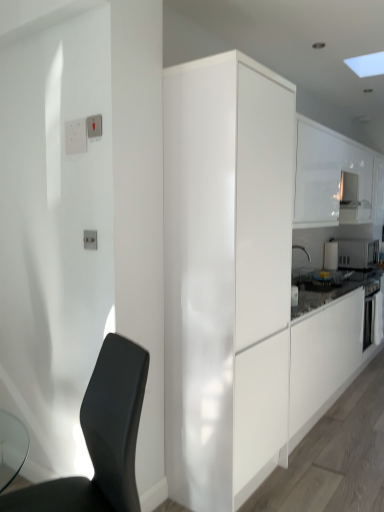
Question: Which is correct: white plastic light switch at upper left, which appears as the first light switch when viewed from the front, is inside glossy white cabinet at center, placed as the first cabinetry when sorted from left to right, or outside of it?

Choices:
 (A) outside
 (B) inside

Answer: (A)

Question: In the image, is white plastic light switch at upper left, the 2th light switch from the left, positioned in front of or behind glossy white cabinet at center, which ranks as the 2th cabinetry in back-to-front order?

Choices:
 (A) behind
 (B) front

Answer: (A)

Question: Which object is positioned farthest from the white glossy microwave at upper right, arranged as the 1th appliance when viewed from the right?

Choices:
 (A) white glossy microwave at upper right, acting as the first appliance starting from the left
 (B) glossy white cabinet at center, which ranks as the 2th cabinetry in back-to-front order
 (C) black matte oven at right
 (D) white plastic light switch at upper left, the first light switch positioned from the right
 (E) white plastic light switch at upper left, the 2th light switch viewed from the front

Answer: (D)

Question: Considering the real-world distances, which object is closest to the white glossy microwave at upper right, acting as the first appliance starting from the left?

Choices:
 (A) white glossy electrical outlet at upper left
 (B) white glossy cabinet at upper right, marked as the 2th cabinetry in a left-to-right arrangement
 (C) white glossy microwave at upper right, the second appliance when ordered from left to right
 (D) matte black chair at lower left
 (E) black matte oven at right

Answer: (C)